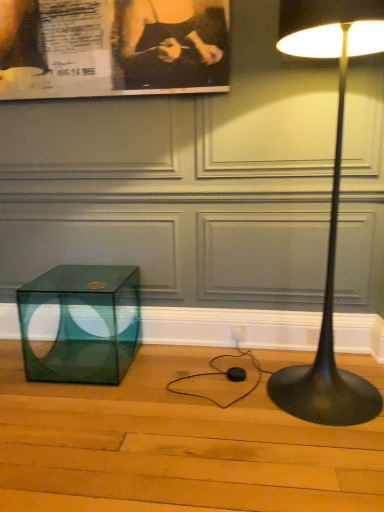
Question: Is there a large distance between black matte floor lamp at right and black paper at upper left?

Choices:
 (A) yes
 (B) no

Answer: (B)

Question: Can you confirm if black matte floor lamp at right is bigger than black paper at upper left?

Choices:
 (A) yes
 (B) no

Answer: (A)

Question: Is black matte floor lamp at right located outside black paper at upper left?

Choices:
 (A) no
 (B) yes

Answer: (B)

Question: Is black matte floor lamp at right oriented towards black paper at upper left?

Choices:
 (A) no
 (B) yes

Answer: (A)

Question: Is the position of black matte floor lamp at right more distant than that of black paper at upper left?

Choices:
 (A) yes
 (B) no

Answer: (B)

Question: From a real-world perspective, is transparent glass cube at lower left physically located above or below black paper at upper left?

Choices:
 (A) above
 (B) below

Answer: (B)

Question: Would you say transparent glass cube at lower left is inside or outside black paper at upper left?

Choices:
 (A) inside
 (B) outside

Answer: (B)

Question: Does point (49, 345) appear closer or farther from the camera than point (177, 31)?

Choices:
 (A) closer
 (B) farther

Answer: (B)

Question: Would you say transparent glass cube at lower left is to the left or to the right of black paper at upper left in the picture?

Choices:
 (A) left
 (B) right

Answer: (A)

Question: Considering the positions of black matte floor lamp at right and black paper at upper left in the image, is black matte floor lamp at right wider or thinner than black paper at upper left?

Choices:
 (A) thin
 (B) wide

Answer: (B)

Question: Based on their sizes in the image, would you say black matte floor lamp at right is bigger or smaller than black paper at upper left?

Choices:
 (A) big
 (B) small

Answer: (A)

Question: Is black matte floor lamp at right to the left or to the right of black paper at upper left in the image?

Choices:
 (A) right
 (B) left

Answer: (A)

Question: Considering the positions of point (307, 25) and point (142, 77), is point (307, 25) closer or farther from the camera than point (142, 77)?

Choices:
 (A) farther
 (B) closer

Answer: (B)

Question: Is point (102, 34) positioned closer to the camera than point (301, 31)?

Choices:
 (A) farther
 (B) closer

Answer: (A)

Question: Is black paper at upper left inside or outside of black matte floor lamp at right?

Choices:
 (A) inside
 (B) outside

Answer: (B)